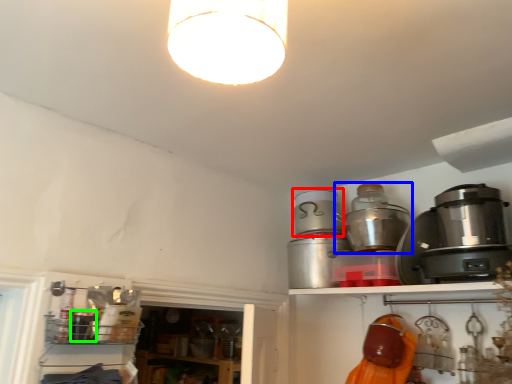
Question: Based on their relative distances, which object is nearer to appliance (highlighted by a red box)? Choose from appliance (highlighted by a blue box) and appliance (highlighted by a green box).

Choices:
 (A) appliance
 (B) appliance

Answer: (A)